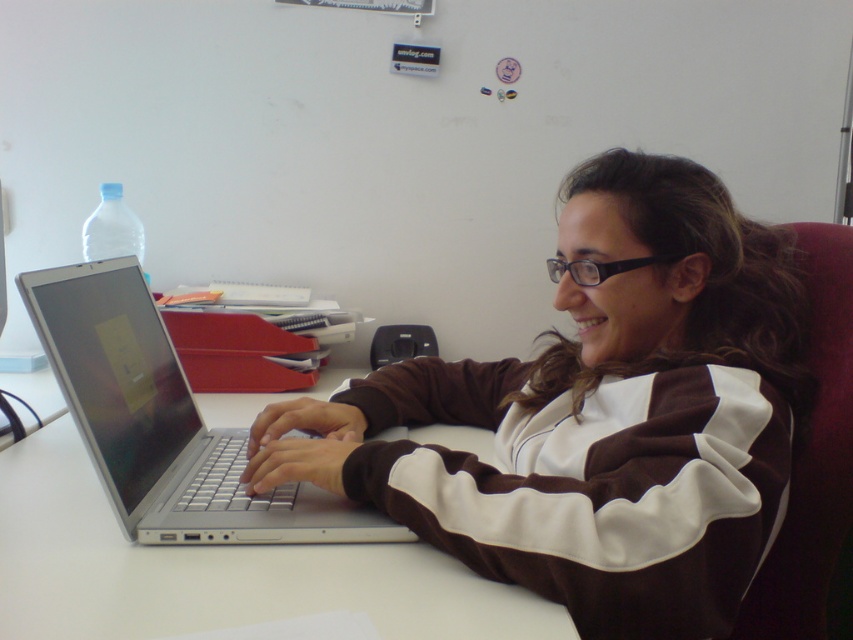
Question: Does brown/white sweater at center have a greater width compared to white smooth table at center?

Choices:
 (A) no
 (B) yes

Answer: (A)

Question: From the image, what is the correct spatial relationship of brown/white sweater at center in relation to white smooth table at center?

Choices:
 (A) right
 (B) left

Answer: (A)

Question: Which point is farther to the camera?

Choices:
 (A) brown/white sweater at center
 (B) silver metallic laptop at center

Answer: (B)

Question: Which point is farther from the camera taking this photo?

Choices:
 (A) (131, 326)
 (B) (274, 412)

Answer: (B)

Question: Which object is farther from the camera taking this photo?

Choices:
 (A) silver metallic laptop at center
 (B) brown/white sweater at center

Answer: (A)

Question: From the image, what is the correct spatial relationship of brown/white sweater at center in relation to silver metallic laptop at center?

Choices:
 (A) left
 (B) right

Answer: (B)